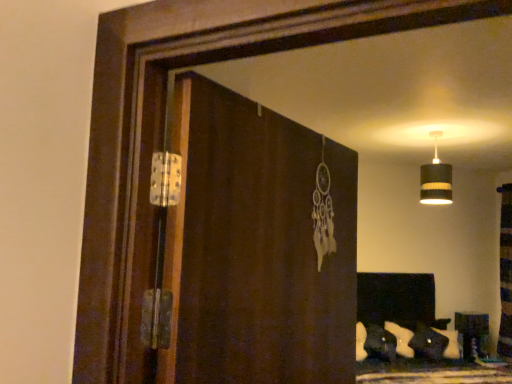
Question: Does brown wooden screen door at center have a greater width compared to black striped lampshade at upper right?

Choices:
 (A) no
 (B) yes

Answer: (A)

Question: Is brown wooden screen door at center facing towards black striped lampshade at upper right?

Choices:
 (A) yes
 (B) no

Answer: (B)

Question: Is brown wooden screen door at center bigger than black striped lampshade at upper right?

Choices:
 (A) no
 (B) yes

Answer: (B)

Question: Is the depth of brown wooden screen door at center less than that of black striped lampshade at upper right?

Choices:
 (A) yes
 (B) no

Answer: (A)

Question: Can you confirm if brown wooden screen door at center is thinner than black striped lampshade at upper right?

Choices:
 (A) no
 (B) yes

Answer: (B)

Question: Does point (461, 314) appear closer or farther from the camera than point (420, 173)?

Choices:
 (A) closer
 (B) farther

Answer: (A)

Question: From a real-world perspective, is wooden bookshelf at right positioned above or below black striped lampshade at upper right?

Choices:
 (A) below
 (B) above

Answer: (A)

Question: Is wooden bookshelf at right to the left or to the right of black striped lampshade at upper right in the image?

Choices:
 (A) left
 (B) right

Answer: (B)

Question: Do you think wooden bookshelf at right is within black striped lampshade at upper right, or outside of it?

Choices:
 (A) inside
 (B) outside

Answer: (B)

Question: Considering their positions, is wooden bookshelf at right located in front of or behind brown wooden screen door at center?

Choices:
 (A) front
 (B) behind

Answer: (B)

Question: In terms of width, does wooden bookshelf at right look wider or thinner when compared to brown wooden screen door at center?

Choices:
 (A) thin
 (B) wide

Answer: (B)

Question: Is wooden bookshelf at right inside or outside of brown wooden screen door at center?

Choices:
 (A) inside
 (B) outside

Answer: (B)

Question: In the image, is wooden bookshelf at right on the left side or the right side of brown wooden screen door at center?

Choices:
 (A) left
 (B) right

Answer: (B)

Question: From a real-world perspective, is black striped lampshade at upper right positioned above or below wooden bookshelf at right?

Choices:
 (A) above
 (B) below

Answer: (A)

Question: Relative to wooden bookshelf at right, is black striped lampshade at upper right in front or behind?

Choices:
 (A) behind
 (B) front

Answer: (B)